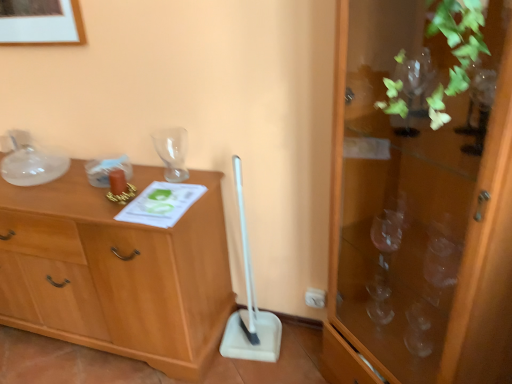
This screenshot has height=384, width=512. Find the location of `wooden chest of drawers at left`. wooden chest of drawers at left is located at coordinates (116, 273).

What do you see at coordinates (172, 152) in the screenshot? This screenshot has width=512, height=384. I see `transparent glass vase at upper center` at bounding box center [172, 152].

This screenshot has width=512, height=384. Identify the location of wooden chest of drawers at left. (116, 273).

From a real-world perspective, is transparent glass vase at upper center over wooden chest of drawers at left?

Yes.

Can you confirm if transparent glass vase at upper center is positioned to the right of wooden chest of drawers at left?

Correct, you'll find transparent glass vase at upper center to the right of wooden chest of drawers at left.

Is transparent glass vase at upper center positioned in front of wooden chest of drawers at left?

No, the depth of transparent glass vase at upper center is greater than that of wooden chest of drawers at left.

Who is taller, transparent glass vase at upper center or wooden chest of drawers at left?

Standing taller between the two is wooden chest of drawers at left.

Does wooden chest of drawers at left have a smaller size compared to transparent glass cabinet at right?

Incorrect, wooden chest of drawers at left is not smaller in size than transparent glass cabinet at right.

This screenshot has width=512, height=384. In the image, there is a transparent glass cabinet at right. Find the location of `the chest of drawers below it (from the image's perspective)`. the chest of drawers below it (from the image's perspective) is located at coordinates (116, 273).

Based on their positions, is wooden chest of drawers at left located to the left or right of transparent glass cabinet at right?

wooden chest of drawers at left is to the left of transparent glass cabinet at right.

Is point (48, 263) closer to camera compared to point (176, 128)?

Yes, it is in front of point (176, 128).

From a real-world perspective, which object rests below the other?

From a 3D spatial view, wooden chest of drawers at left is below.

Is wooden chest of drawers at left thinner than transparent glass vase at upper center?

No.

From the image's perspective, which is above, transparent glass cabinet at right or transparent glass vase at upper center?

transparent glass vase at upper center is shown above in the image.

Would you say transparent glass cabinet at right is a long distance from transparent glass vase at upper center?

No, transparent glass cabinet at right is not far from transparent glass vase at upper center.

From the picture: Can you tell me how much transparent glass cabinet at right and transparent glass vase at upper center differ in facing direction?

They differ by 44.3 degrees in their facing directions.

Considering the relative sizes of transparent glass cabinet at right and transparent glass vase at upper center in the image provided, is transparent glass cabinet at right taller than transparent glass vase at upper center?

Yes.

This screenshot has width=512, height=384. Identify the location of shovel that is on the left side of transparent glass cabinet at right. (250, 308).

Does point (257, 358) appear closer or farther from the camera than point (446, 382)?

Point (257, 358) is farther from the camera than point (446, 382).

Are white plastic shovel at center and transparent glass cabinet at right making contact?

There is a gap between white plastic shovel at center and transparent glass cabinet at right.

Visually, is transparent glass cabinet at right positioned to the left or to the right of white plastic shovel at center?

From the image, it's evident that transparent glass cabinet at right is to the right of white plastic shovel at center.

Considering the sizes of objects transparent glass cabinet at right and white plastic shovel at center in the image provided, who is thinner, transparent glass cabinet at right or white plastic shovel at center?

Thinner between the two is white plastic shovel at center.

Which is closer to the camera, (386, 45) or (231, 317)?

Point (386, 45) appears to be closer to the viewer than point (231, 317).

Can you confirm if transparent glass cabinet at right is taller than white plastic shovel at center?

Indeed, transparent glass cabinet at right has a greater height compared to white plastic shovel at center.

Find the location of a particular element. This screenshot has width=512, height=384. glass vase behind the white plastic shovel at center is located at coordinates (172, 152).

Is white plastic shovel at center closer to the viewer compared to transparent glass vase at upper center?

Yes.

Who is shorter, white plastic shovel at center or transparent glass vase at upper center?

Standing shorter between the two is transparent glass vase at upper center.

Does white plastic shovel at center turn towards transparent glass vase at upper center?

No, white plastic shovel at center is not aimed at transparent glass vase at upper center.

The width and height of the screenshot is (512, 384). Find the location of `glass vase located above the wooden chest of drawers at left (from a real-world perspective)`. glass vase located above the wooden chest of drawers at left (from a real-world perspective) is located at coordinates (172, 152).

Locate an element on the screen. the chest of drawers that is under the transparent glass cabinet at right (from a real-world perspective) is located at coordinates (116, 273).

When comparing their distances from white plastic shovel at center, does wooden chest of drawers at left or transparent glass vase at upper center seem further?

The object further to white plastic shovel at center is transparent glass vase at upper center.

Considering their positions, is transparent glass cabinet at right positioned closer to transparent glass vase at upper center than wooden chest of drawers at left?

wooden chest of drawers at left.

In the scene shown: Estimate the real-world distances between objects in this image. Which object is closer to transparent glass cabinet at right, white plastic shovel at center or transparent glass vase at upper center?

white plastic shovel at center lies closer to transparent glass cabinet at right than the other object.

Considering their positions, is transparent glass cabinet at right positioned further to transparent glass vase at upper center than white plastic shovel at center?

Based on the image, transparent glass cabinet at right appears to be further to transparent glass vase at upper center.

Estimate the real-world distances between objects in this image. Which object is further from transparent glass vase at upper center, wooden chest of drawers at left or transparent glass cabinet at right?

Based on the image, transparent glass cabinet at right appears to be further to transparent glass vase at upper center.

Which object lies nearer to the anchor point wooden chest of drawers at left, white plastic shovel at center or transparent glass vase at upper center?

white plastic shovel at center is closer to wooden chest of drawers at left.

Estimate the real-world distances between objects in this image. Which object is further from wooden chest of drawers at left, transparent glass cabinet at right or white plastic shovel at center?

transparent glass cabinet at right is further to wooden chest of drawers at left.

From the image, which object appears to be nearer to wooden chest of drawers at left, white plastic shovel at center or transparent glass cabinet at right?

white plastic shovel at center.

You are a GUI agent. You are given a task and a screenshot of the screen. Output one action in this format:
    pyautogui.click(x=<x>, y=<y>)
    Task: Click on the shovel between transparent glass cabinet at right and transparent glass vase at upper center along the z-axis
    
    Given the screenshot: What is the action you would take?
    pyautogui.click(x=250, y=308)

Identify the location of shovel situated between wooden chest of drawers at left and transparent glass cabinet at right from left to right. (250, 308).

The height and width of the screenshot is (384, 512). I want to click on glass vase situated between wooden chest of drawers at left and white plastic shovel at center from left to right, so click(172, 152).

Locate an element on the screen. glass vase located between wooden chest of drawers at left and transparent glass cabinet at right in the left-right direction is located at coordinates (172, 152).